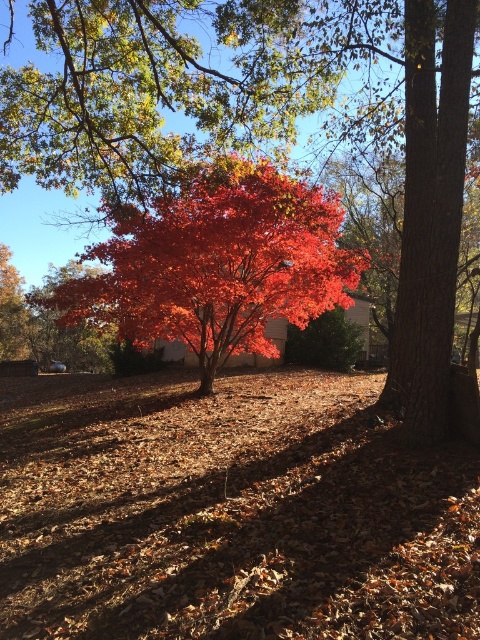
Question: In this image, where is shiny red maple tree at center located relative to glossy red maple at center?

Choices:
 (A) left
 (B) right

Answer: (A)

Question: Is shiny red maple tree at center above glossy red maple at center?

Choices:
 (A) yes
 (B) no

Answer: (A)

Question: Which point is closer to the camera?

Choices:
 (A) glossy red maple at center
 (B) shiny red maple tree at center

Answer: (B)

Question: Can you confirm if shiny red maple tree at center is bigger than glossy red maple at center?

Choices:
 (A) yes
 (B) no

Answer: (A)

Question: Which of the following is the closest to the observer?

Choices:
 (A) (239, 65)
 (B) (192, 218)

Answer: (B)